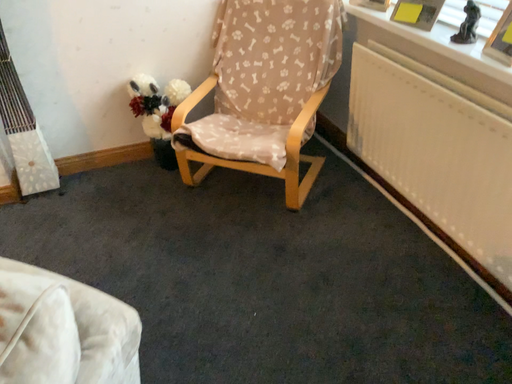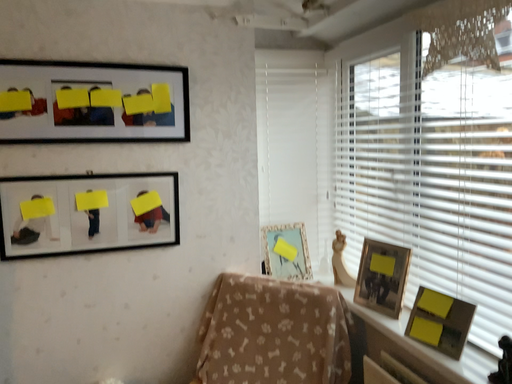
Question: Which way did the camera rotate in the video?

Choices:
 (A) rotated upward
 (B) rotated downward

Answer: (A)